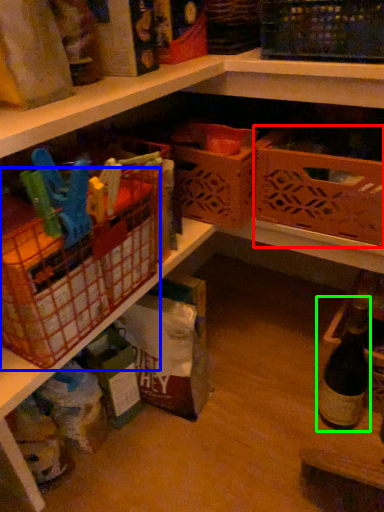
Question: Which object is positioned farthest from basket (highlighted by a red box)? Select from basket (highlighted by a blue box) and bottle (highlighted by a green box).

Choices:
 (A) basket
 (B) bottle

Answer: (A)